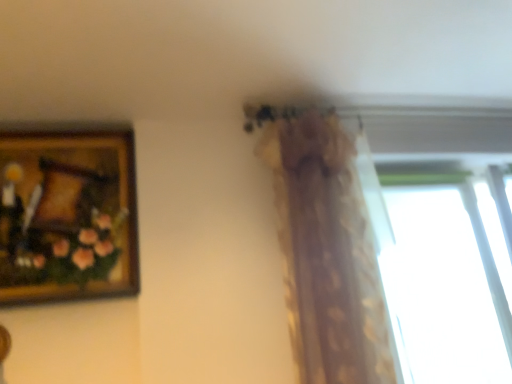
Question: From a real-world perspective, is translucent floral-patterned curtain at upper center on wooden framed painting at upper left?

Choices:
 (A) yes
 (B) no

Answer: (B)

Question: Could wooden framed painting at upper left be considered to be inside translucent floral-patterned curtain at upper center?

Choices:
 (A) yes
 (B) no

Answer: (B)

Question: Is translucent floral-patterned curtain at upper center thinner than wooden framed painting at upper left?

Choices:
 (A) no
 (B) yes

Answer: (A)

Question: From a real-world perspective, is translucent floral-patterned curtain at upper center located beneath wooden framed painting at upper left?

Choices:
 (A) yes
 (B) no

Answer: (A)

Question: Is translucent floral-patterned curtain at upper center positioned with its back to wooden framed painting at upper left?

Choices:
 (A) yes
 (B) no

Answer: (B)

Question: From the image's perspective, is translucent floral-patterned curtain at upper center on top of wooden framed painting at upper left?

Choices:
 (A) yes
 (B) no

Answer: (B)

Question: Is wooden framed painting at upper left bigger than transparent glass window at upper right?

Choices:
 (A) no
 (B) yes

Answer: (B)

Question: Is wooden framed painting at upper left oriented away from transparent glass window at upper right?

Choices:
 (A) yes
 (B) no

Answer: (B)

Question: Can you confirm if wooden framed painting at upper left is shorter than transparent glass window at upper right?

Choices:
 (A) no
 (B) yes

Answer: (B)

Question: Is wooden framed painting at upper left positioned in front of transparent glass window at upper right?

Choices:
 (A) yes
 (B) no

Answer: (A)

Question: Can transparent glass window at upper right be found inside wooden framed painting at upper left?

Choices:
 (A) yes
 (B) no

Answer: (B)

Question: Is wooden framed painting at upper left to the left of transparent glass window at upper right from the viewer's perspective?

Choices:
 (A) no
 (B) yes

Answer: (B)

Question: Is transparent glass window at upper right aimed at translucent floral-patterned curtain at upper center?

Choices:
 (A) no
 (B) yes

Answer: (A)